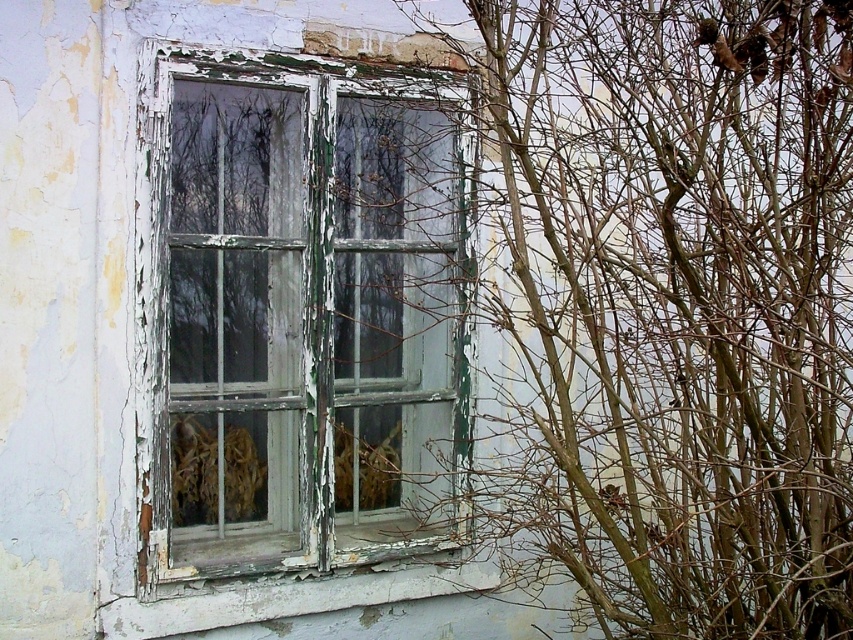
Which is more to the right, bare branches at right or green peeling paint window at center?

bare branches at right is more to the right.

In the scene shown: Does bare branches at right come in front of green peeling paint window at center?

Yes.

Where is `bare branches at right`? The width and height of the screenshot is (853, 640). bare branches at right is located at coordinates (682, 305).

At what (x,y) coordinates should I click in order to perform the action: click on bare branches at right. Please return your answer as a coordinate pair (x, y). The width and height of the screenshot is (853, 640). Looking at the image, I should click on (682, 305).

Does green peeling paint window at center appear on the right side of peeling white paint at lower center?

No, green peeling paint window at center is not to the right of peeling white paint at lower center.

Can you confirm if green peeling paint window at center is wider than peeling white paint at lower center?

In fact, green peeling paint window at center might be narrower than peeling white paint at lower center.

The width and height of the screenshot is (853, 640). I want to click on green peeling paint window at center, so click(x=300, y=316).

In order to click on green peeling paint window at center in this screenshot , I will do `click(300, 316)`.

In the scene shown: Who is higher up, bare branches at right or peeling white paint at lower center?

bare branches at right is higher up.

Which is below, bare branches at right or peeling white paint at lower center?

peeling white paint at lower center

Does point (635, 605) lie in front of point (132, 608)?

No, (635, 605) is behind (132, 608).

At what (x,y) coordinates should I click in order to perform the action: click on bare branches at right. Please return your answer as a coordinate pair (x, y). This screenshot has height=640, width=853. Looking at the image, I should click on (682, 305).